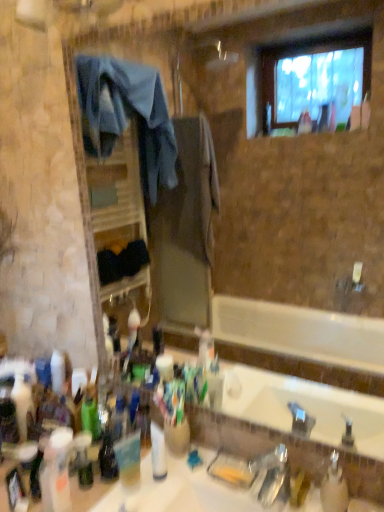
Question: From the image's perspective, is translucent plastic bottle at lower left, marked as the fifth bottle in a right-to-left arrangement, located above translucent plastic bottle at lower left, which is the 2th bottle in back-to-front order?

Choices:
 (A) no
 (B) yes

Answer: (A)

Question: From a real-world perspective, is translucent plastic bottle at lower left, positioned as the 4th bottle in back-to-front order, located higher than translucent plastic bottle at lower left, which is the 2th bottle in back-to-front order?

Choices:
 (A) no
 (B) yes

Answer: (B)

Question: Does translucent plastic bottle at lower left, placed as the second bottle when sorted from front to back, appear on the right side of translucent plastic bottle at lower left, which is the 2th bottle in back-to-front order?

Choices:
 (A) yes
 (B) no

Answer: (B)

Question: Would you consider translucent plastic bottle at lower left, marked as the fifth bottle in a right-to-left arrangement, to be distant from translucent plastic bottle at lower left, the third bottle when ordered from right to left?

Choices:
 (A) yes
 (B) no

Answer: (B)

Question: Can you confirm if translucent plastic bottle at lower left, positioned as the 4th bottle in back-to-front order, is shorter than translucent plastic bottle at lower left, the 4th bottle viewed from the front?

Choices:
 (A) yes
 (B) no

Answer: (B)

Question: Does translucent plastic bottle at lower left, positioned as the 4th bottle in back-to-front order, lie behind translucent plastic bottle at lower left, which is the 2th bottle in back-to-front order?

Choices:
 (A) no
 (B) yes

Answer: (A)

Question: Considering the relative sizes of clear plastic bottle at lower right, positioned as the 1th bottle in right-to-left order, and translucent plastic cup at lower center in the image provided, is clear plastic bottle at lower right, positioned as the 1th bottle in right-to-left order, bigger than translucent plastic cup at lower center?

Choices:
 (A) yes
 (B) no

Answer: (A)

Question: Considering the relative positions of clear plastic bottle at lower right, arranged as the fifth bottle when viewed from the back, and translucent plastic cup at lower center in the image provided, is clear plastic bottle at lower right, arranged as the fifth bottle when viewed from the back, to the left of translucent plastic cup at lower center from the viewer's perspective?

Choices:
 (A) yes
 (B) no

Answer: (B)

Question: Is clear plastic bottle at lower right, positioned as the 1th bottle in right-to-left order, positioned beyond the bounds of translucent plastic cup at lower center?

Choices:
 (A) no
 (B) yes

Answer: (B)

Question: Is clear plastic bottle at lower right, which appears as the 5th bottle when viewed from the left, behind translucent plastic cup at lower center?

Choices:
 (A) yes
 (B) no

Answer: (B)

Question: Can you confirm if clear plastic bottle at lower right, placed as the first bottle when sorted from front to back, is shorter than translucent plastic cup at lower center?

Choices:
 (A) no
 (B) yes

Answer: (A)

Question: Is clear plastic bottle at lower right, placed as the first bottle when sorted from front to back, not near translucent plastic cup at lower center?

Choices:
 (A) no
 (B) yes

Answer: (A)

Question: From a real-world perspective, is yellow matte soap dispenser at lower right, the 3th toiletry from the left, located higher than translucent plastic bottle at lower left, the 4th bottle viewed from the front?

Choices:
 (A) yes
 (B) no

Answer: (B)